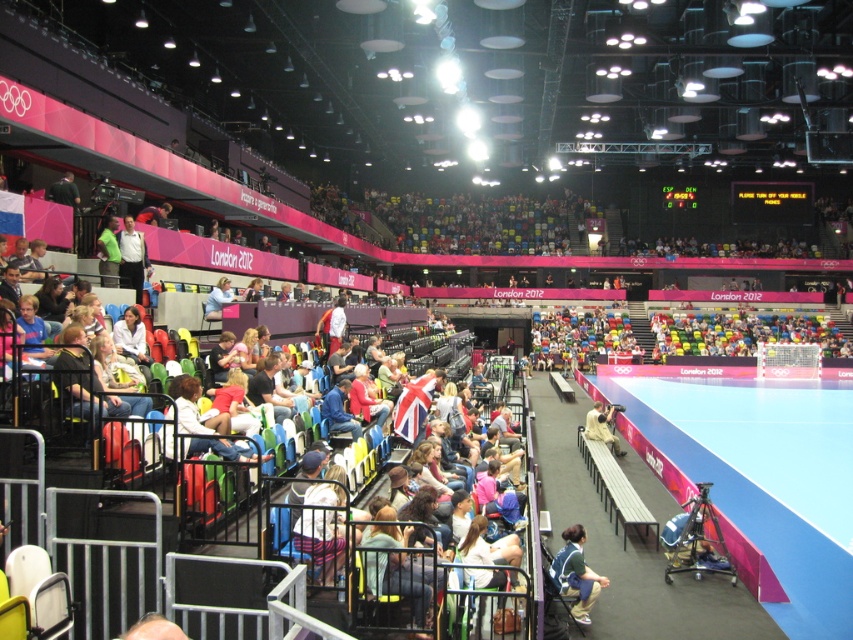
Question: Can you confirm if dark green fabric jacket at lower center is positioned to the right of light blue shirt at center?

Choices:
 (A) yes
 (B) no

Answer: (A)

Question: Which point appears farthest from the camera in this image?

Choices:
 (A) (192, 442)
 (B) (225, 294)

Answer: (B)

Question: Which point is closer to the camera taking this photo?

Choices:
 (A) (225, 285)
 (B) (196, 380)
 (C) (601, 577)

Answer: (B)

Question: Can you confirm if khaki fabric jacket at center is wider than light blue shirt at center?

Choices:
 (A) yes
 (B) no

Answer: (A)

Question: Among these objects, which one is nearest to the camera?

Choices:
 (A) light blue shirt at center
 (B) white fabric jacket at center
 (C) dark green fabric jacket at lower center

Answer: (B)

Question: Is dark green fabric jacket at lower center bigger than light blue shirt at center?

Choices:
 (A) no
 (B) yes

Answer: (A)